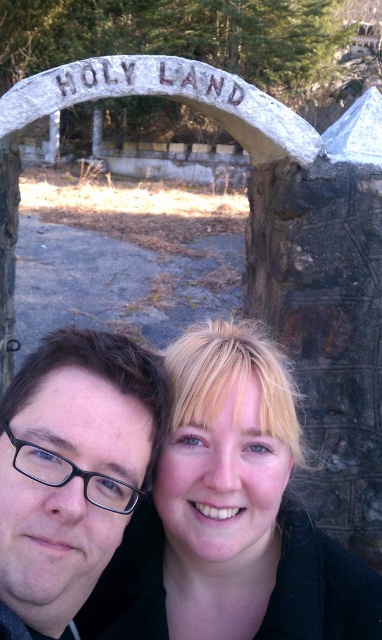
Can you confirm if blonde hair at center is positioned to the right of matte black glasses at center?

Indeed, blonde hair at center is positioned on the right side of matte black glasses at center.

Does blonde hair at center appear over matte black glasses at center?

Actually, blonde hair at center is below matte black glasses at center.

Between point (220, 339) and point (33, 381), which one is positioned behind?

Point (220, 339)

This screenshot has height=640, width=382. In order to click on blonde hair at center in this screenshot , I will do point(229,516).